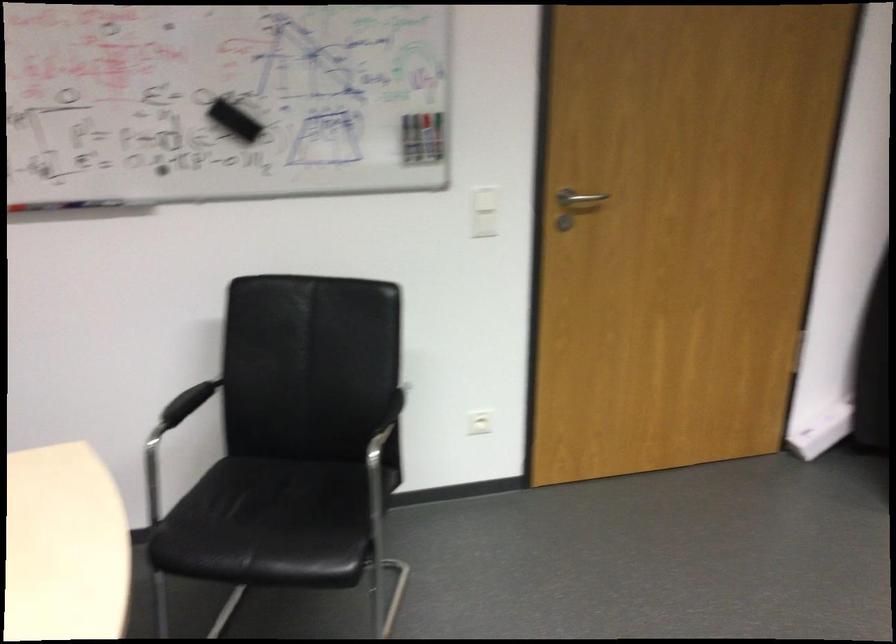
Describe the element at coordinates (478, 422) in the screenshot. I see `the white light switch` at that location.